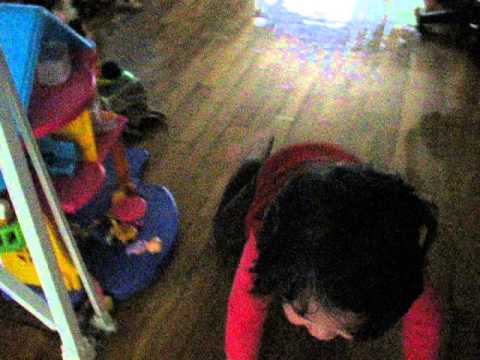
Find the location of `doll head`. doll head is located at coordinates (156, 244).